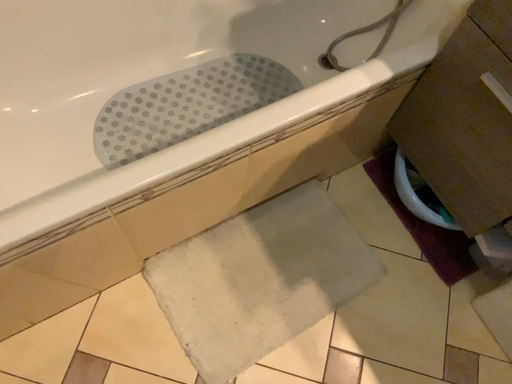
This screenshot has height=384, width=512. What are the coordinates of `vacant space in between beige matte tile at lower right and white soft bath mat at lower center, which ranks as the first bath mat in left-to-right order` in the screenshot? It's located at (382, 306).